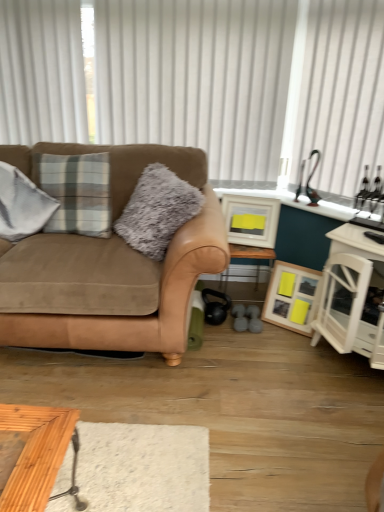
Locate an element on the screen. free space in front of wooden picture frame at lower right, which ranks as the second picture frame in top-to-bottom order is located at coordinates (295, 344).